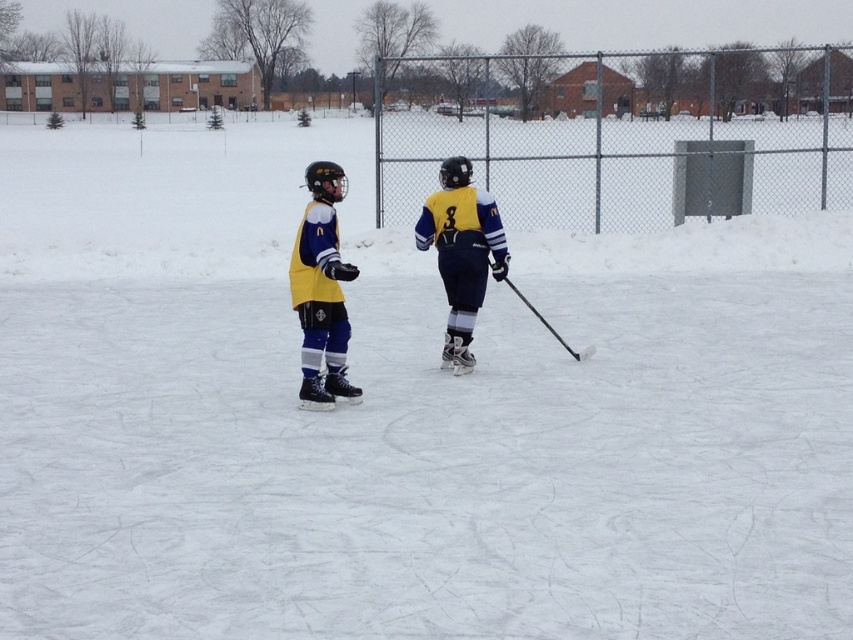
Question: Can you confirm if yellow matte hockey jersey at center is positioned above yellow jersey at center?

Choices:
 (A) yes
 (B) no

Answer: (B)

Question: Does yellow matte hockey jersey at center have a lesser width compared to yellow jersey at center?

Choices:
 (A) yes
 (B) no

Answer: (A)

Question: Which point is closer to the camera?

Choices:
 (A) (318, 172)
 (B) (463, 356)

Answer: (A)

Question: Which object is closer to the camera taking this photo?

Choices:
 (A) yellow jersey at center
 (B) yellow matte hockey jersey at center

Answer: (B)

Question: Is yellow matte hockey jersey at center positioned in front of yellow jersey at center?

Choices:
 (A) yes
 (B) no

Answer: (A)